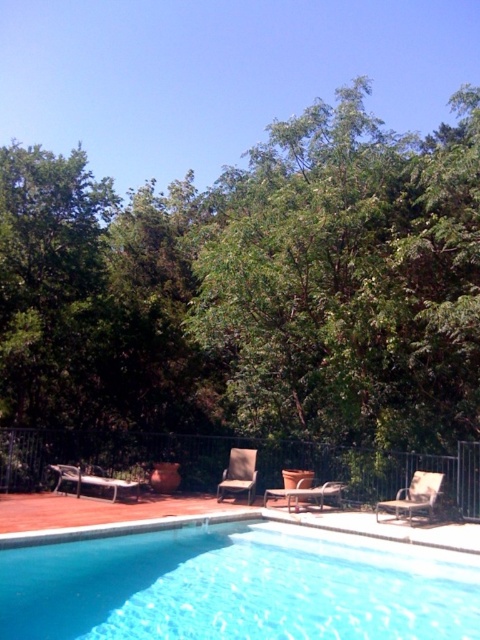
The image size is (480, 640). Find the location of `black metal fence at lower center`. black metal fence at lower center is located at coordinates (227, 461).

Between point (396, 481) and point (400, 492), which one is positioned behind?

The point (396, 481) is behind.

Where is `black metal fence at lower center`? Image resolution: width=480 pixels, height=640 pixels. black metal fence at lower center is located at coordinates (227, 461).

Does black metal fence at lower center appear on the left side of matte brown lounge chair at center?

Indeed, black metal fence at lower center is positioned on the left side of matte brown lounge chair at center.

Does black metal fence at lower center have a lesser width compared to matte brown lounge chair at center?

Incorrect, black metal fence at lower center's width is not less than matte brown lounge chair at center's.

Who is more distant from viewer, (28, 445) or (336, 496)?

Point (28, 445)

Find the location of a particular element. black metal fence at lower center is located at coordinates (227, 461).

Can you confirm if blue glossy water at center is taller than brown fabric chair at center?

No, blue glossy water at center is not taller than brown fabric chair at center.

Is point (324, 608) farther from camera compared to point (239, 490)?

No, (324, 608) is closer to viewer.

Is point (255, 540) more distant than point (230, 456)?

No.

Where is `blue glossy water at center`? Image resolution: width=480 pixels, height=640 pixels. blue glossy water at center is located at coordinates (239, 586).